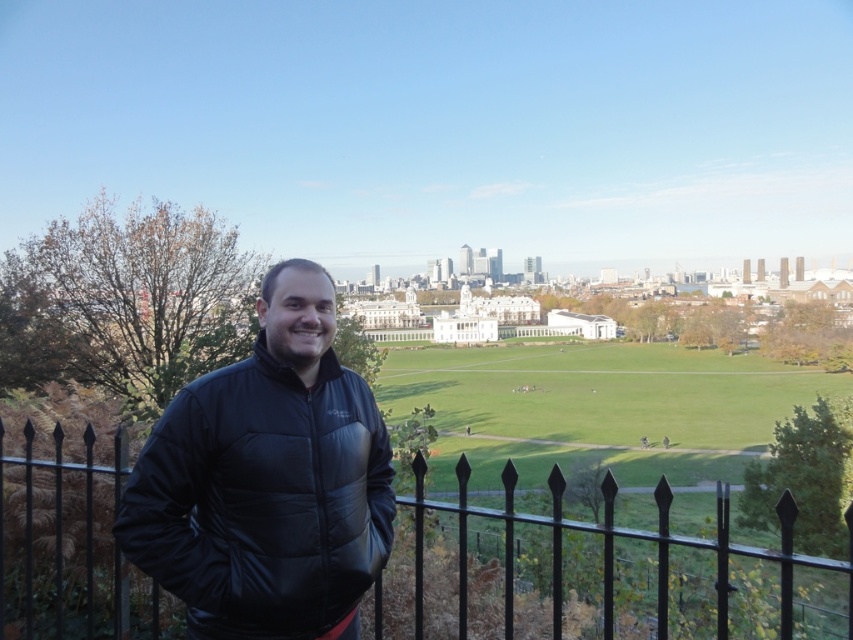
Question: Which object appears farthest from the camera in this image?

Choices:
 (A) black synthetic jacket at left
 (B) black metal fence at center

Answer: (A)

Question: Is black synthetic jacket at left behind black metal fence at center?

Choices:
 (A) yes
 (B) no

Answer: (A)

Question: Considering the relative positions of black synthetic jacket at left and black metal fence at center in the image provided, where is black synthetic jacket at left located with respect to black metal fence at center?

Choices:
 (A) right
 (B) left

Answer: (B)

Question: Is black synthetic jacket at left closer to camera compared to black metal fence at center?

Choices:
 (A) no
 (B) yes

Answer: (A)